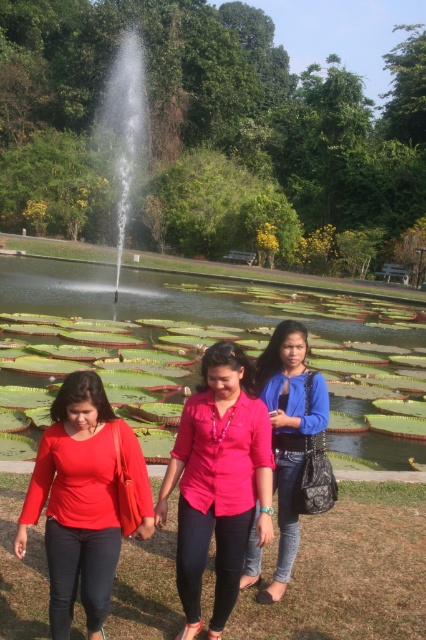
You are standing in the outdoor scene and want to walk towards the two points marked in the image. Which point, point (x=55, y=580) or point (x=236, y=365), will you reach first?

You will reach point (x=55, y=580) first because it is closer to you than point (x=236, y=365).

You are a fashion designer observing the two women wearing the matte red blouse at lower left and the matte pink blouse at center. Which blouse has a wider silhouette?

The matte red blouse at lower left has a wider silhouette than the matte pink blouse at center.

You are a photographer trying to capture a candid shot of the two women wearing the matte pink blouse at center and the blue denim jacket at center. Since you want to ensure both are fully visible in the frame, which one should you adjust your camera angle to focus on first?

The matte pink blouse at center is not as tall as the blue denim jacket at center, so you should focus on the blue denim jacket at center first to ensure the shorter matte pink blouse at center is fully captured in the frame.